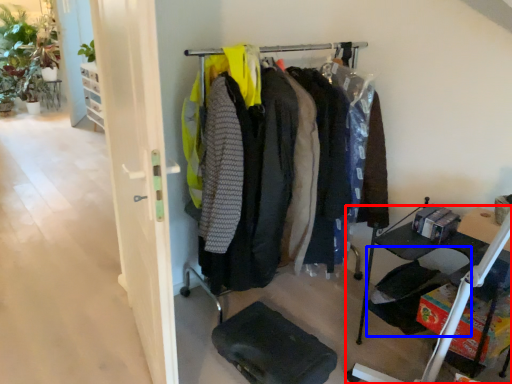
Question: Among these objects, which one is nearest to the camera, furniture (highlighted by a red box) or folding chair (highlighted by a blue box)?

Choices:
 (A) furniture
 (B) folding chair

Answer: (A)